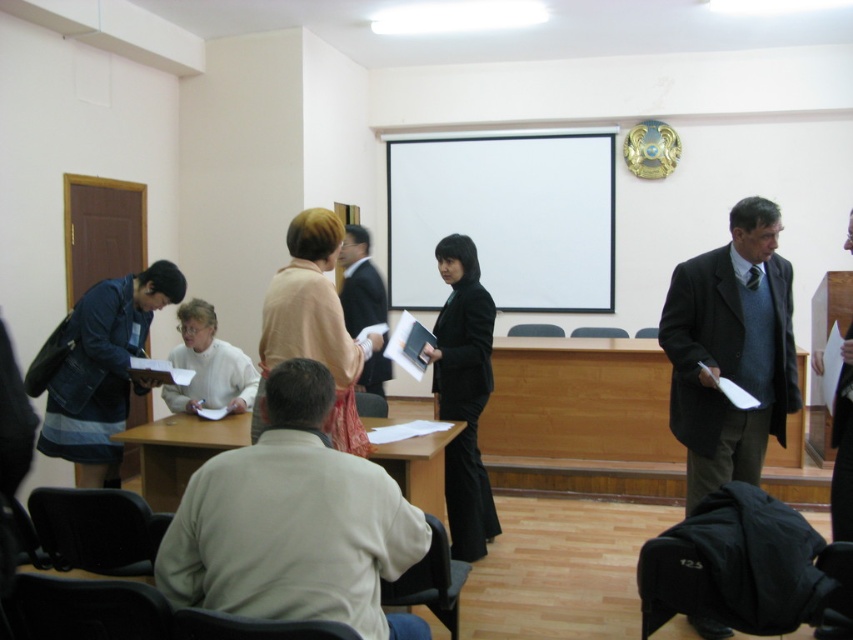
Question: Which is nearer to the beige fabric jacket at center?

Choices:
 (A) dark gray suit at center
 (B) light beige sweater at center

Answer: (B)

Question: Which point appears farthest from the camera in this image?

Choices:
 (A) (363, 310)
 (B) (468, 397)

Answer: (A)

Question: Where is white matte projector screen at upper center located in relation to light beige sweater at center in the image?

Choices:
 (A) right
 (B) left

Answer: (A)

Question: Is black matte suit at center to the left of white matte sweater at center from the viewer's perspective?

Choices:
 (A) yes
 (B) no

Answer: (B)

Question: Which of the following is the closest to the observer?

Choices:
 (A) (277, 397)
 (B) (285, 314)
 (C) (200, 426)
 (D) (54, 397)

Answer: (A)

Question: Is dark gray suit at right closer to the viewer compared to black matte suit at center?

Choices:
 (A) no
 (B) yes

Answer: (B)